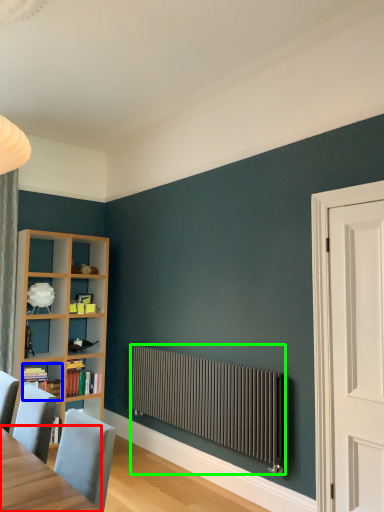
Question: Estimate the real-world distances between objects in this image. Which object is closer to table (highlighted by a red box), book (highlighted by a blue box) or radiator (highlighted by a green box)?

Choices:
 (A) book
 (B) radiator

Answer: (B)